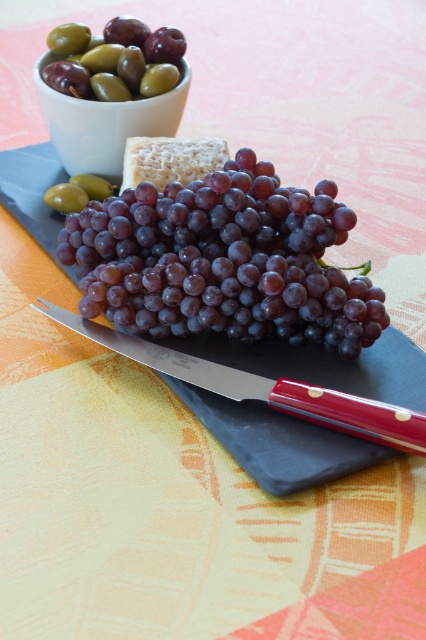
Question: Does shiny purple grapes at center appear over green olive at upper left?

Choices:
 (A) yes
 (B) no

Answer: (B)

Question: Which point is farther to the camera?

Choices:
 (A) (45, 61)
 (B) (81, 328)
 (C) (103, 52)
 (D) (299, 220)

Answer: (A)

Question: Does polished red handle knife at center come in front of green olive at upper left?

Choices:
 (A) yes
 (B) no

Answer: (A)

Question: Considering the real-world distances, which object is farthest from the shiny purple grapes at center?

Choices:
 (A) green olive at upper left
 (B) polished red handle knife at center

Answer: (A)

Question: Can you confirm if shiny purple grapes at center is wider than polished red handle knife at center?

Choices:
 (A) yes
 (B) no

Answer: (B)

Question: Which point is farther from the camera taking this photo?

Choices:
 (A) (83, 152)
 (B) (134, 64)

Answer: (A)